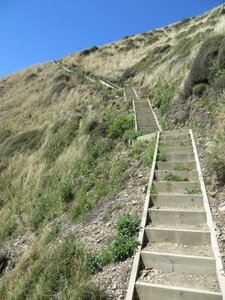
Where is `1 left side of stairs`? 1 left side of stairs is located at coordinates (35, 164).